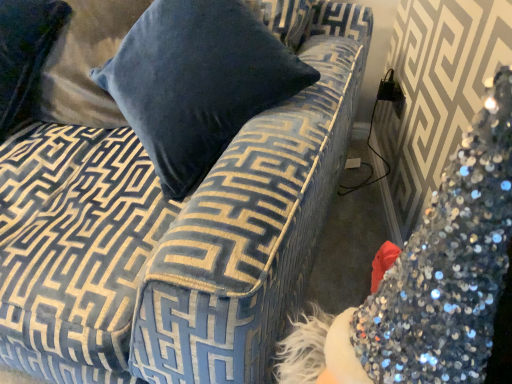
This screenshot has height=384, width=512. Describe the element at coordinates (175, 231) in the screenshot. I see `velvet blue couch at upper left` at that location.

This screenshot has width=512, height=384. I want to click on velvet blue couch at upper left, so click(x=175, y=231).

Where is `velvet blue pillow at upper left`? This screenshot has width=512, height=384. velvet blue pillow at upper left is located at coordinates (25, 53).

Describe the element at coordinates (25, 53) in the screenshot. The image size is (512, 384). I see `velvet blue pillow at upper left` at that location.

Locate an element on the screen. The image size is (512, 384). velvet blue couch at upper left is located at coordinates coord(175,231).

Considering the positions of objects velvet blue pillow at upper left and velvet blue couch at upper left in the image provided, who is more to the right, velvet blue pillow at upper left or velvet blue couch at upper left?

velvet blue couch at upper left is more to the right.

Relative to velvet blue couch at upper left, is velvet blue pillow at upper left in front or behind?

Clearly, velvet blue pillow at upper left is behind velvet blue couch at upper left.

Which point is more forward, (22,107) or (35,308)?

Point (35,308)

From the image's perspective, is velvet blue pillow at upper left over velvet blue couch at upper left?

Yes, from the image's perspective, velvet blue pillow at upper left is on top of velvet blue couch at upper left.

From a real-world perspective, between velvet blue pillow at upper left and velvet blue couch at upper left, who is vertically higher?

From a 3D spatial view, velvet blue pillow at upper left is above.

Based on the photo, looking at their sizes, would you say velvet blue pillow at upper left is wider or thinner than velvet blue couch at upper left?

Considering their sizes, velvet blue pillow at upper left looks slimmer than velvet blue couch at upper left.

Can you confirm if velvet blue pillow at upper left is taller than velvet blue couch at upper left?

In fact, velvet blue pillow at upper left may be shorter than velvet blue couch at upper left.

In terms of size, does velvet blue pillow at upper left appear bigger or smaller than velvet blue couch at upper left?

Clearly, velvet blue pillow at upper left is smaller in size than velvet blue couch at upper left.

Which is correct: velvet blue pillow at upper left is inside velvet blue couch at upper left, or outside of it?

velvet blue pillow at upper left exists entirely within velvet blue couch at upper left.

Is there a large distance between velvet blue pillow at upper left and velvet blue couch at upper left?

velvet blue pillow at upper left is near velvet blue couch at upper left, not far away.

Is velvet blue pillow at upper left facing towards velvet blue couch at upper left?

Yes, velvet blue pillow at upper left is turned towards velvet blue couch at upper left.

Identify the location of studio couch in front of the velvet blue pillow at upper left. (175, 231).

In the image, is velvet blue couch at upper left on the left side or the right side of velvet blue pillow at upper left?

Clearly, velvet blue couch at upper left is on the right of velvet blue pillow at upper left in the image.

Consider the image. Is velvet blue couch at upper left closer to camera compared to velvet blue pillow at upper left?

Yes, velvet blue couch at upper left is closer to the camera.

Is point (8, 249) closer or farther from the camera than point (48, 16)?

Point (8, 249) appears to be closer to the viewer than point (48, 16).

From the image's perspective, between velvet blue couch at upper left and velvet blue pillow at upper left, which one is located above?

velvet blue pillow at upper left.

From a real-world perspective, who is located lower, velvet blue couch at upper left or velvet blue pillow at upper left?

velvet blue couch at upper left is physically lower.

Can you confirm if velvet blue couch at upper left is wider than velvet blue pillow at upper left?

Yes, velvet blue couch at upper left is wider than velvet blue pillow at upper left.

Is velvet blue couch at upper left shorter than velvet blue pillow at upper left?

No.

Who is smaller, velvet blue couch at upper left or velvet blue pillow at upper left?

velvet blue pillow at upper left.

Is velvet blue couch at upper left spatially inside velvet blue pillow at upper left, or outside of it?

The correct answer is: outside.

Is velvet blue couch at upper left far away from velvet blue pillow at upper left?

velvet blue couch at upper left is actually quite close to velvet blue pillow at upper left.

Based on the photo, is velvet blue couch at upper left looking in the opposite direction of velvet blue pillow at upper left?

Yes, velvet blue couch at upper left's orientation is away from velvet blue pillow at upper left.

How far apart are velvet blue couch at upper left and velvet blue pillow at upper left?

A distance of 18.75 inches exists between velvet blue couch at upper left and velvet blue pillow at upper left.

At what (x,y) coordinates should I click in order to perform the action: click on pillow above the velvet blue couch at upper left (from a real-world perspective). Please return your answer as a coordinate pair (x, y). This screenshot has width=512, height=384. Looking at the image, I should click on (25, 53).

This screenshot has width=512, height=384. What are the coordinates of `pillow that is on the left side of velvet blue couch at upper left` in the screenshot? It's located at (25, 53).

The image size is (512, 384). In the image, there is a velvet blue pillow at upper left. Identify the location of studio couch below it (from the image's perspective). (175, 231).